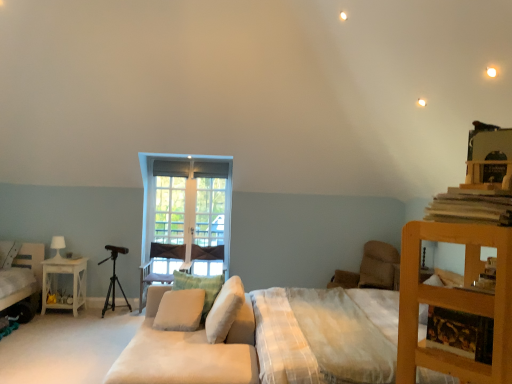
Image resolution: width=512 pixels, height=384 pixels. I want to click on white fabric bed at lower left, so click(20, 279).

This screenshot has width=512, height=384. What do you see at coordinates (371, 269) in the screenshot?
I see `beige fabric armchair at center-right, which is the first armchair in right-to-left order` at bounding box center [371, 269].

Image resolution: width=512 pixels, height=384 pixels. Describe the element at coordinates (158, 273) in the screenshot. I see `velvet purple armchair at center, the 1th armchair when ordered from left to right` at that location.

The image size is (512, 384). I want to click on wooden bookshelf at right, so click(455, 301).

In order to click on white soft cushion at center, the 4th pillow viewed from the back in this screenshot , I will do `click(224, 310)`.

What do you see at coordinates (73, 282) in the screenshot? This screenshot has width=512, height=384. I see `white glossy nightstand at left` at bounding box center [73, 282].

Locate an element on the screen. white soft pillow at lower left, marked as the 1th pillow in a left-to-right arrangement is located at coordinates (8, 252).

The image size is (512, 384). What are the coordinates of `white fabric bed at lower left` in the screenshot? It's located at (20, 279).

Between point (170, 246) and point (115, 257), which one is positioned behind?

Point (170, 246)

How different are the orientations of velvet purple armchair at center, which appears as the second armchair when viewed from the right, and wooden tripod at left in degrees?

The angular difference between velvet purple armchair at center, which appears as the second armchair when viewed from the right, and wooden tripod at left is 0.581 degrees.

This screenshot has width=512, height=384. What are the coordinates of `tripod lying above the velvet purple armchair at center, which appears as the second armchair when viewed from the right (from the image's perspective)` in the screenshot? It's located at (114, 279).

In the scene shown: From the image's perspective, which is below, velvet purple armchair at center, the 1th armchair when ordered from left to right, or wooden tripod at left?

velvet purple armchair at center, the 1th armchair when ordered from left to right, from the image's perspective.

Considering the positions of points (211, 314) and (378, 272), is point (211, 314) farther from camera compared to point (378, 272)?

No, (211, 314) is in front of (378, 272).

Which of these two, white soft cushion at center, the 4th pillow viewed from the back, or beige fabric armchair at center-right, which is the first armchair in right-to-left order, stands shorter?

With less height is white soft cushion at center, the 4th pillow viewed from the back.

Consider the image. Relative to beige fabric armchair at center-right, which is the first armchair in right-to-left order, is white soft cushion at center, which is counted as the first pillow, starting from the right, in front or behind?

Visually, white soft cushion at center, which is counted as the first pillow, starting from the right, is located in front of beige fabric armchair at center-right, which is the first armchair in right-to-left order.

From the image's perspective, who appears lower, white soft pillow at lower left, which is counted as the 4th pillow, starting from the front, or white soft cushion at center, the 2th pillow viewed from the front?

white soft cushion at center, the 2th pillow viewed from the front, from the image's perspective.

Which object is more forward, white soft pillow at lower left, which appears as the fourth pillow when viewed from the right, or white soft cushion at center, which is the 3th pillow from right to left?

white soft cushion at center, which is the 3th pillow from right to left, is in front.

Does white soft pillow at lower left, marked as the 1th pillow in a left-to-right arrangement, turn towards white soft cushion at center, which is the 3th pillow from right to left?

No.

Which object is thinner, white soft pillow at lower left, marked as the 1th pillow in a left-to-right arrangement, or white soft cushion at center, which is the 3th pillow from right to left?

With smaller width is white soft pillow at lower left, marked as the 1th pillow in a left-to-right arrangement.

Considering the sizes of objects beige fabric pillow at center, positioned as the 3th pillow in left-to-right order, and soft beige fabric couch at center in the image provided, who is smaller, beige fabric pillow at center, positioned as the 3th pillow in left-to-right order, or soft beige fabric couch at center?

beige fabric pillow at center, positioned as the 3th pillow in left-to-right order, is smaller.

Does beige fabric pillow at center, the third pillow positioned from the front, appear on the left side of soft beige fabric couch at center?

Yes, beige fabric pillow at center, the third pillow positioned from the front, is to the left of soft beige fabric couch at center.

Which object is closer to the camera taking this photo, beige fabric pillow at center, positioned as the 3th pillow in left-to-right order, or soft beige fabric couch at center?

soft beige fabric couch at center is closer to the camera.

How many degrees apart are the facing directions of beige fabric pillow at center, the third pillow positioned from the front, and soft beige fabric couch at center?

The angular difference between beige fabric pillow at center, the third pillow positioned from the front, and soft beige fabric couch at center is 78.1 degrees.

Which is closer, (33, 258) or (221, 326)?

The point (221, 326) is more forward.

From a real-world perspective, is white fabric bed at lower left over white soft cushion at center, marked as the 4th pillow in a left-to-right arrangement?

No, from a real-world perspective, white fabric bed at lower left is not on top of white soft cushion at center, marked as the 4th pillow in a left-to-right arrangement.

From the picture: Considering the sizes of objects white fabric bed at lower left and white soft cushion at center, positioned as the 1th pillow in front-to-back order, in the image provided, who is thinner, white fabric bed at lower left or white soft cushion at center, positioned as the 1th pillow in front-to-back order,?

white soft cushion at center, positioned as the 1th pillow in front-to-back order, is thinner.

The width and height of the screenshot is (512, 384). Find the location of `bed that appears on the left of white soft cushion at center, which is counted as the first pillow, starting from the right`. bed that appears on the left of white soft cushion at center, which is counted as the first pillow, starting from the right is located at coordinates (20, 279).

From the image's perspective, is white wooden window at center over wooden tripod at left?

Yes, from the image's perspective, white wooden window at center is on top of wooden tripod at left.

Could wooden tripod at left be considered to be inside white wooden window at center?

No, wooden tripod at left is not a part of white wooden window at center.

Is white wooden window at center to the left or to the right of wooden tripod at left in the image?

In the image, white wooden window at center appears on the right side of wooden tripod at left.

Is white wooden window at center bigger than wooden tripod at left?

Incorrect, white wooden window at center is not larger than wooden tripod at left.

Are white wooden window at center and wooden bookshelf at right making contact?

They are not placed beside each other.

Which is in front, point (229, 169) or point (414, 333)?

The point (414, 333) is more forward.

Considering the positions of objects white wooden window at center and wooden bookshelf at right in the image provided, who is in front, white wooden window at center or wooden bookshelf at right?

wooden bookshelf at right is in front.

Is white wooden window at center positioned with its back to wooden bookshelf at right?

No.

The width and height of the screenshot is (512, 384). Identify the location of armchair below the wooden tripod at left (from the image's perspective). (158, 273).

This screenshot has width=512, height=384. Identify the location of armchair located above the white soft cushion at center, which is counted as the first pillow, starting from the right (from a real-world perspective). (371, 269).

Based on their spatial positions, is wooden bookshelf at right or wooden tripod at left closer to white fabric bed at lower left?

wooden tripod at left is positioned closer to the anchor white fabric bed at lower left.

From the image, which object appears to be nearer to beige fabric armchair at center-right, which is the second armchair from left to right, wooden bookshelf at right or white glossy nightstand at left?

wooden bookshelf at right is closer to beige fabric armchair at center-right, which is the second armchair from left to right.

Which object lies nearer to the anchor point wooden bookshelf at right, white soft pillow at lower left, which is the 1th pillow in back-to-front order, or soft beige fabric couch at center?

soft beige fabric couch at center is positioned closer to the anchor wooden bookshelf at right.

Estimate the real-world distances between objects in this image. Which object is further from velvet purple armchair at center, which appears as the second armchair when viewed from the right, white glossy table lamp at left or white soft pillow at lower left, which is the 1th pillow in back-to-front order?

white soft pillow at lower left, which is the 1th pillow in back-to-front order, is positioned further to the anchor velvet purple armchair at center, which appears as the second armchair when viewed from the right.

Estimate the real-world distances between objects in this image. Which object is closer to velvet purple armchair at center, which appears as the second armchair when viewed from the right, white wooden window at center or white fabric bed at lower left?

Based on the image, white wooden window at center appears to be nearer to velvet purple armchair at center, which appears as the second armchair when viewed from the right.

From the image, which object appears to be farther from white soft cushion at center, marked as the 4th pillow in a left-to-right arrangement, beige fabric pillow at center, which is the second pillow in back-to-front order, or velvet purple armchair at center, which appears as the second armchair when viewed from the right?

velvet purple armchair at center, which appears as the second armchair when viewed from the right, is further to white soft cushion at center, marked as the 4th pillow in a left-to-right arrangement.

Looking at the image, which one is located further to soft beige fabric couch at center, white fabric bed at lower left or wooden tripod at left?

wooden tripod at left is further to soft beige fabric couch at center.

Looking at the image, which one is located closer to white wooden window at center, white soft cushion at center, the 2th pillow viewed from the front, or white soft pillow at lower left, which is counted as the 4th pillow, starting from the front?

The object closer to white wooden window at center is white soft cushion at center, the 2th pillow viewed from the front.

In order to click on nightstand located between white fabric bed at lower left and beige fabric pillow at center, the third pillow positioned from the front, in the left-right direction in this screenshot , I will do `click(73, 282)`.

In order to click on tripod between white glossy table lamp at left and velvet purple armchair at center, which appears as the second armchair when viewed from the right in this screenshot , I will do pyautogui.click(x=114, y=279).

Where is `table lamp between soft beige fabric couch at center and white wooden window at center from front to back`? This screenshot has width=512, height=384. table lamp between soft beige fabric couch at center and white wooden window at center from front to back is located at coordinates (57, 246).

Identify the location of pillow positioned between white soft cushion at center, positioned as the 1th pillow in front-to-back order, and beige fabric pillow at center, which is the second pillow in back-to-front order, from near to far. (180, 310).